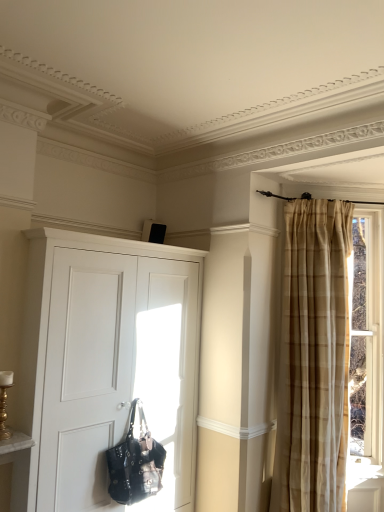
Question: Is brown plaid curtain at right thinner than white matte cupboard at center?

Choices:
 (A) no
 (B) yes

Answer: (B)

Question: Is brown plaid curtain at right positioned behind white matte cupboard at center?

Choices:
 (A) no
 (B) yes

Answer: (B)

Question: Considering the relative sizes of brown plaid curtain at right and white matte cupboard at center in the image provided, is brown plaid curtain at right shorter than white matte cupboard at center?

Choices:
 (A) no
 (B) yes

Answer: (B)

Question: Would you say brown plaid curtain at right is outside white matte cupboard at center?

Choices:
 (A) yes
 (B) no

Answer: (A)

Question: Can you confirm if brown plaid curtain at right is bigger than white matte cupboard at center?

Choices:
 (A) yes
 (B) no

Answer: (B)

Question: Is the depth of brown plaid curtain at right less than that of white matte cupboard at center?

Choices:
 (A) no
 (B) yes

Answer: (A)

Question: Is shiny black leather handbag at lower left to the left of brown plaid curtain at right from the viewer's perspective?

Choices:
 (A) no
 (B) yes

Answer: (B)

Question: Is brown plaid curtain at right a part of shiny black leather handbag at lower left?

Choices:
 (A) yes
 (B) no

Answer: (B)

Question: Considering the relative sizes of shiny black leather handbag at lower left and brown plaid curtain at right in the image provided, is shiny black leather handbag at lower left wider than brown plaid curtain at right?

Choices:
 (A) yes
 (B) no

Answer: (B)

Question: Is shiny black leather handbag at lower left taller than brown plaid curtain at right?

Choices:
 (A) no
 (B) yes

Answer: (A)

Question: Is shiny black leather handbag at lower left positioned beyond the bounds of brown plaid curtain at right?

Choices:
 (A) yes
 (B) no

Answer: (A)

Question: Is shiny black leather handbag at lower left thinner than brown plaid curtain at right?

Choices:
 (A) no
 (B) yes

Answer: (B)

Question: From a real-world perspective, is white matte cupboard at center on top of brown plaid curtain at right?

Choices:
 (A) no
 (B) yes

Answer: (A)